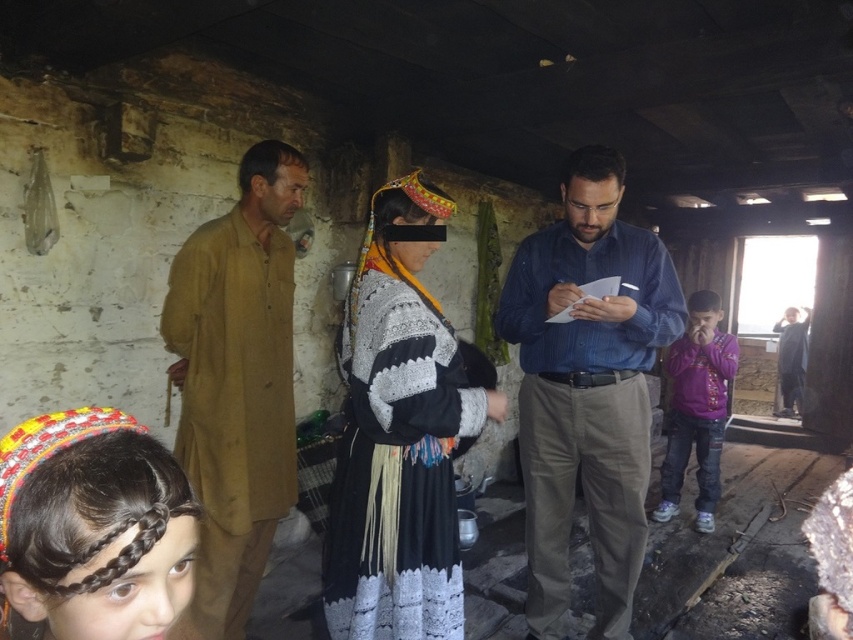
Question: Which object is farther from the camera taking this photo?

Choices:
 (A) blue striped shirt at center
 (B) purple denim jeans at right
 (C) dark brown braided hair at lower left

Answer: (B)

Question: Can you confirm if knitted woolen dress at center is positioned to the right of purple denim jeans at right?

Choices:
 (A) yes
 (B) no

Answer: (B)

Question: Among these points, which one is nearest to the camera?

Choices:
 (A) tap(717, 496)
 (B) tap(149, 477)

Answer: (B)

Question: Observing the image, what is the correct spatial positioning of blue striped shirt at center in reference to knitted woolen dress at center?

Choices:
 (A) above
 (B) below

Answer: (B)

Question: Which object is positioned closest to the brown cotton robe at left?

Choices:
 (A) dark brown braided hair at lower left
 (B) purple denim jeans at right
 (C) blue striped shirt at center
 (D) knitted woolen dress at center

Answer: (D)

Question: Is knitted woolen dress at center further to the viewer compared to brown cotton robe at left?

Choices:
 (A) no
 (B) yes

Answer: (A)